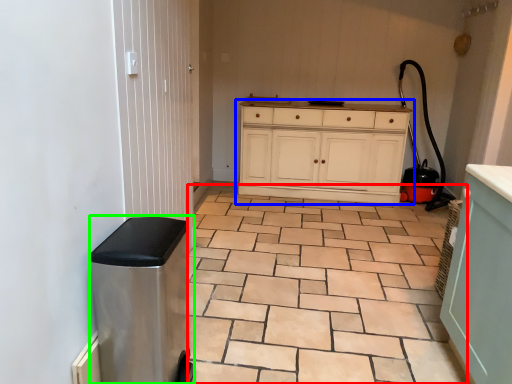
Question: Which object is positioned farthest from ceramic tile (highlighted by a red box)? Select from chest of drawers (highlighted by a blue box) and water heater (highlighted by a green box).

Choices:
 (A) chest of drawers
 (B) water heater

Answer: (A)